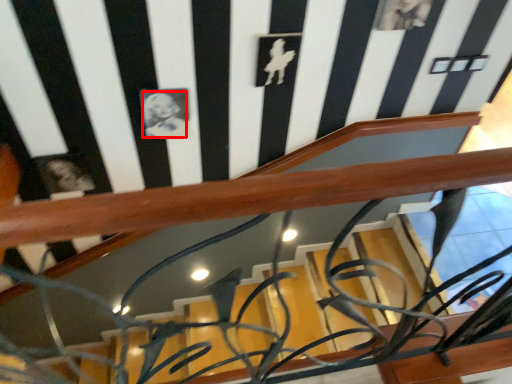
Question: In this image, where is art (annotated by the red box) located relative to art?

Choices:
 (A) left
 (B) right

Answer: (B)